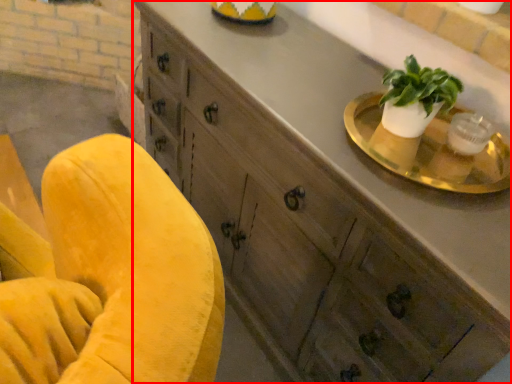
Question: Considering the relative positions of cabinetry (annotated by the red box) and round table in the image provided, where is cabinetry (annotated by the red box) located with respect to the staircase?

Choices:
 (A) right
 (B) left

Answer: (B)